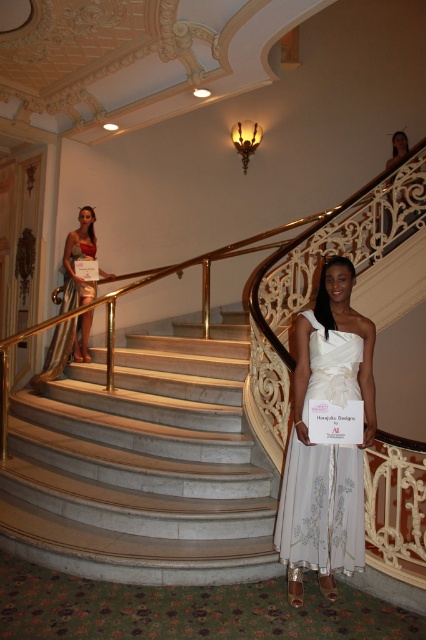
You are a photographer planning to capture the grandeur of the white marble stairs at center and the shiny gold dress at upper left in a single shot. Given that the camera can only focus on one object clearly, which object should you prioritize to ensure it fills more of the frame?

The white marble stairs at center should be prioritized as they are larger in size than the shiny gold dress at upper left, allowing them to fill more of the frame.

You are a fashion designer observing two dresses in the image. The first is the white satin dress at center, and the second is the shiny gold dress at upper left. Which dress is wider?

The white satin dress at center is wider than the shiny gold dress at upper left.

Consider the image. You are standing at the entrance of the building and want to reach the white marble stairs at center. According to the coordinates provided, in which direction should you move relative to your current position?

The white marble stairs at center is located at point coordinates, so you should move towards the center of the image to reach it.